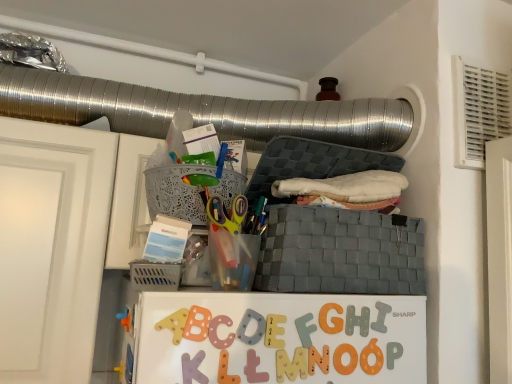
Question: Is wooden letter n at center, which ranks as the 5th alphabet in left-to-right order, at the left side of gray woven basket at center, the first basket in the right-to-left sequence?

Choices:
 (A) yes
 (B) no

Answer: (A)

Question: From the image's perspective, is wooden letter n at center, which ranks as the second alphabet in right-to-left order, beneath gray woven basket at center, the first basket in the right-to-left sequence?

Choices:
 (A) no
 (B) yes

Answer: (B)

Question: Is wooden letter n at center, which ranks as the 5th alphabet in left-to-right order, surrounding gray woven basket at center, placed as the second basket when sorted from left to right?

Choices:
 (A) yes
 (B) no

Answer: (B)

Question: Is wooden letter n at center, which ranks as the second alphabet in right-to-left order, taller than gray woven basket at center, placed as the second basket when sorted from left to right?

Choices:
 (A) no
 (B) yes

Answer: (A)

Question: Is wooden letter n at center, which ranks as the second alphabet in right-to-left order, positioned with its back to gray woven basket at center, placed as the second basket when sorted from left to right?

Choices:
 (A) no
 (B) yes

Answer: (A)

Question: Does point (230, 192) appear closer or farther from the camera than point (381, 327)?

Choices:
 (A) farther
 (B) closer

Answer: (A)

Question: Based on their sizes in the image, would you say lacy plastic basket at upper center, the 1th basket when ordered from left to right, is bigger or smaller than gray matte letter i at center, placed as the first alphabet when sorted from right to left?

Choices:
 (A) big
 (B) small

Answer: (A)

Question: Would you say lacy plastic basket at upper center, the second basket positioned from the right, is to the left or to the right of gray matte letter i at center, the 6th alphabet in the left-to-right sequence, in the picture?

Choices:
 (A) right
 (B) left

Answer: (B)

Question: From a real-world perspective, is lacy plastic basket at upper center, the 1th basket when ordered from left to right, above or below gray matte letter i at center, placed as the first alphabet when sorted from right to left?

Choices:
 (A) above
 (B) below

Answer: (A)

Question: Considering their positions, is orange foam letter g at center, the 2th letter positioned from the bottom, located in front of or behind wooden letter n at center, which ranks as the second alphabet in right-to-left order?

Choices:
 (A) front
 (B) behind

Answer: (B)

Question: Based on their sizes in the image, would you say orange foam letter g at center, arranged as the first letter when viewed from the top, is bigger or smaller than wooden letter n at center, which ranks as the 5th alphabet in left-to-right order?

Choices:
 (A) small
 (B) big

Answer: (A)

Question: Is orange foam letter g at center, arranged as the first letter when viewed from the top, taller or shorter than wooden letter n at center, which ranks as the 5th alphabet in left-to-right order?

Choices:
 (A) short
 (B) tall

Answer: (B)

Question: Is orange foam letter g at center, arranged as the first letter when viewed from the top, inside the boundaries of wooden letter n at center, which ranks as the 5th alphabet in left-to-right order, or outside?

Choices:
 (A) outside
 (B) inside

Answer: (A)

Question: In terms of width, does gray woven basket at center, the first basket in the right-to-left sequence, look wider or thinner when compared to gray matte letter i at center, the 6th alphabet in the left-to-right sequence?

Choices:
 (A) wide
 (B) thin

Answer: (A)

Question: Considering the positions of point tap(336, 218) and point tap(377, 309), is point tap(336, 218) closer or farther from the camera than point tap(377, 309)?

Choices:
 (A) closer
 (B) farther

Answer: (B)